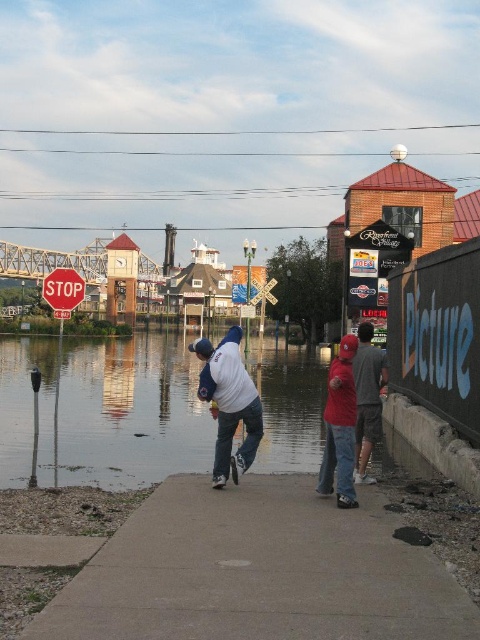
Is point (213, 400) farther from viewer compared to point (50, 298)?

No, it is not.

Locate an element on the screen. The width and height of the screenshot is (480, 640). white matte baseball cap at center is located at coordinates (228, 403).

Who is more distant from viewer, [363,385] or [78,291]?

The point [78,291] is behind.

Can you confirm if gray cotton t-shirt at right is positioned to the left of red matte stop sign at upper left?

Incorrect, gray cotton t-shirt at right is not on the left side of red matte stop sign at upper left.

Which is behind, point (360, 326) or point (76, 282)?

The point (76, 282) is behind.

Where is `gray cotton t-shirt at right`? Image resolution: width=480 pixels, height=640 pixels. gray cotton t-shirt at right is located at coordinates (368, 397).

Is concrete sidewalk at lower left behind red matte baseball cap at center?

No, concrete sidewalk at lower left is in front of red matte baseball cap at center.

Between concrete sidewalk at lower left and red matte baseball cap at center, which one has less height?

Standing shorter between the two is concrete sidewalk at lower left.

Describe the element at coordinates (257, 572) in the screenshot. I see `concrete sidewalk at lower left` at that location.

Locate an element on the screen. concrete sidewalk at lower left is located at coordinates (257, 572).